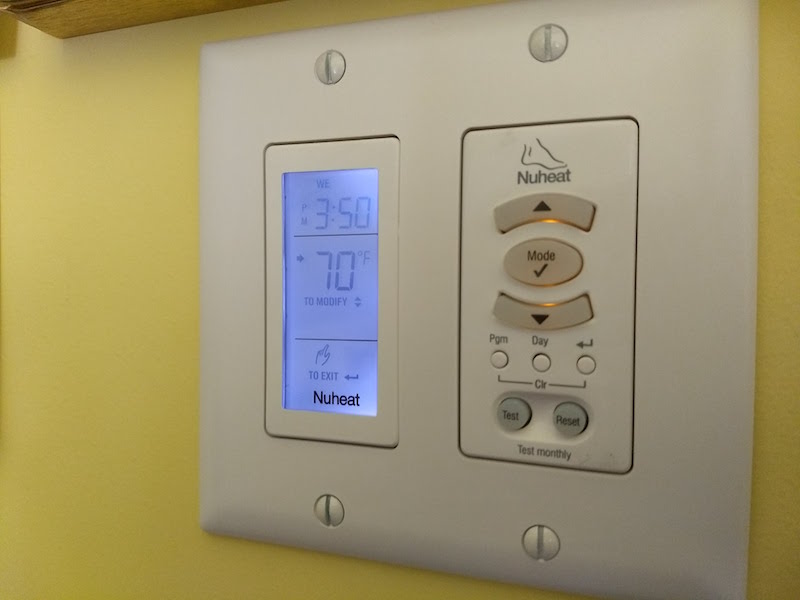
Locate an element on the screen. This screenshot has width=800, height=600. blue led light is located at coordinates (329, 335).